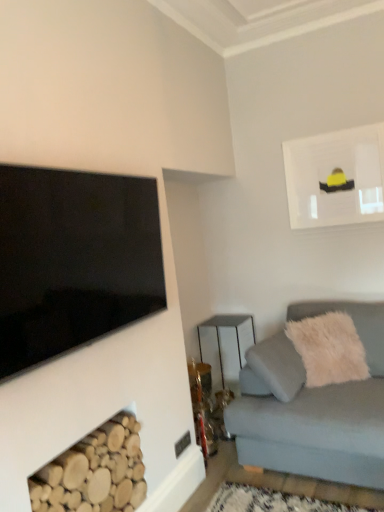
Question: Is metallic silver table at center smaller than black glossy tv at upper left?

Choices:
 (A) no
 (B) yes

Answer: (A)

Question: From the image's perspective, is metallic silver table at center under black glossy tv at upper left?

Choices:
 (A) yes
 (B) no

Answer: (A)

Question: Considering the relative sizes of metallic silver table at center and black glossy tv at upper left in the image provided, is metallic silver table at center wider than black glossy tv at upper left?

Choices:
 (A) no
 (B) yes

Answer: (B)

Question: From a real-world perspective, is metallic silver table at center positioned over black glossy tv at upper left based on gravity?

Choices:
 (A) no
 (B) yes

Answer: (A)

Question: Considering the relative sizes of metallic silver table at center and black glossy tv at upper left in the image provided, is metallic silver table at center thinner than black glossy tv at upper left?

Choices:
 (A) no
 (B) yes

Answer: (A)

Question: Can you confirm if metallic silver table at center is positioned to the right of black glossy tv at upper left?

Choices:
 (A) yes
 (B) no

Answer: (A)

Question: Is natural wood logs at lower left at the left side of white fluffy pillow at right?

Choices:
 (A) yes
 (B) no

Answer: (A)

Question: Considering the relative sizes of natural wood logs at lower left and white fluffy pillow at right in the image provided, is natural wood logs at lower left bigger than white fluffy pillow at right?

Choices:
 (A) no
 (B) yes

Answer: (A)

Question: Is natural wood logs at lower left to the right of white fluffy pillow at right from the viewer's perspective?

Choices:
 (A) yes
 (B) no

Answer: (B)

Question: Is natural wood logs at lower left wider than white fluffy pillow at right?

Choices:
 (A) yes
 (B) no

Answer: (B)

Question: Does natural wood logs at lower left have a lesser height compared to white fluffy pillow at right?

Choices:
 (A) yes
 (B) no

Answer: (A)

Question: Is white fluffy pillow at right surrounded by natural wood logs at lower left?

Choices:
 (A) no
 (B) yes

Answer: (A)

Question: From a real-world perspective, is matte white picture frame at upper right physically below light gray fabric couch at lower right?

Choices:
 (A) yes
 (B) no

Answer: (B)